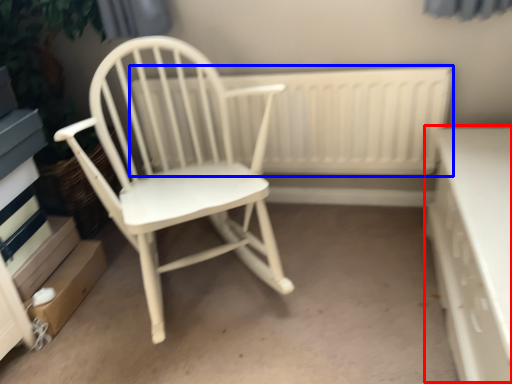
Question: Which of the following is the farthest to the observer, table (highlighted by a red box) or radiator (highlighted by a blue box)?

Choices:
 (A) table
 (B) radiator

Answer: (B)